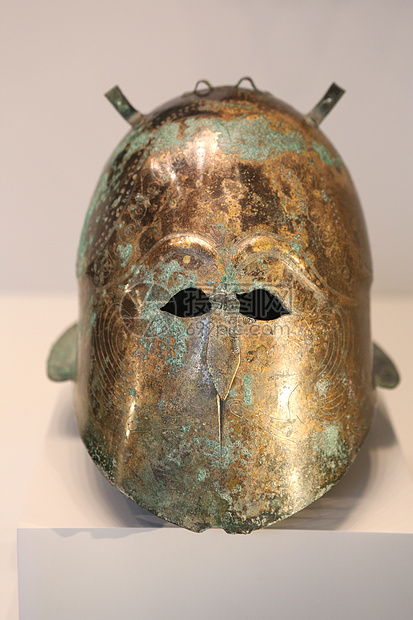
Find the location of a particular element. The image size is (413, 620). table is located at coordinates (49, 418).